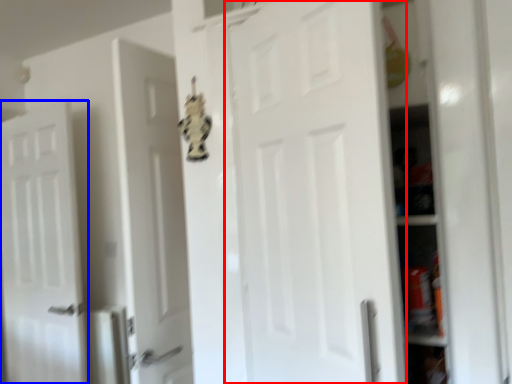
Question: Which point is closer to the camera, door (highlighted by a red box) or door (highlighted by a blue box)?

Choices:
 (A) door
 (B) door

Answer: (A)